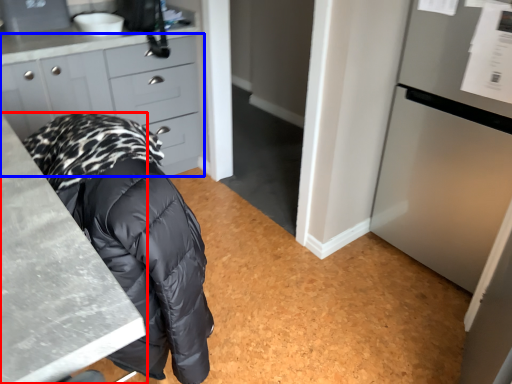
Question: Which of the following is the farthest to the observer, countertop (highlighted by a red box) or cabinetry (highlighted by a blue box)?

Choices:
 (A) countertop
 (B) cabinetry

Answer: (B)